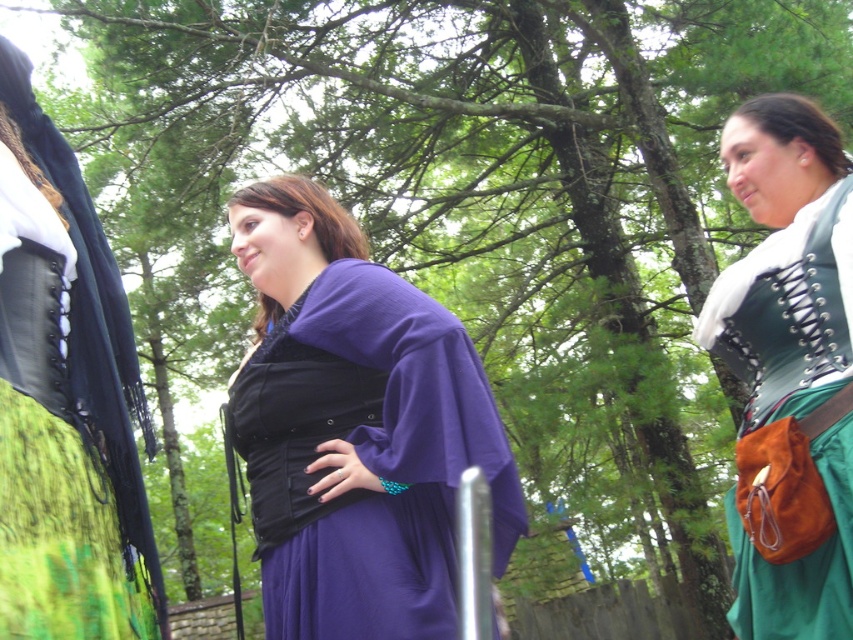
Question: Which point is farther from the camera taking this photo?

Choices:
 (A) (239, 198)
 (B) (68, 486)
 (C) (256, 396)
 (D) (790, 508)

Answer: (A)

Question: Is the position of purple satin dress at center less distant than that of purple matte dress at center?

Choices:
 (A) yes
 (B) no

Answer: (A)

Question: Estimate the real-world distances between objects in this image. Which object is closer to the purple matte dress at center?

Choices:
 (A) green suede skirt at center
 (B) purple satin dress at center

Answer: (B)

Question: Which object is the farthest from the purple velvet dress at center?

Choices:
 (A) purple satin dress at center
 (B) green suede skirt at center

Answer: (B)

Question: Observing the image, what is the correct spatial positioning of green suede skirt at center in reference to matte green fabric at right?

Choices:
 (A) right
 (B) left

Answer: (B)

Question: Observing the image, what is the correct spatial positioning of purple satin dress at center in reference to purple velvet dress at center?

Choices:
 (A) left
 (B) right

Answer: (B)